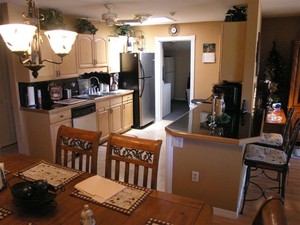
You are a GUI agent. You are given a task and a screenshot of the screen. Output one action in this format:
    pyautogui.click(x=<x>, y=<y>)
    Task: Click on the clock
    The image size is (300, 225).
    Given the screenshot: What is the action you would take?
    (x=171, y=31)